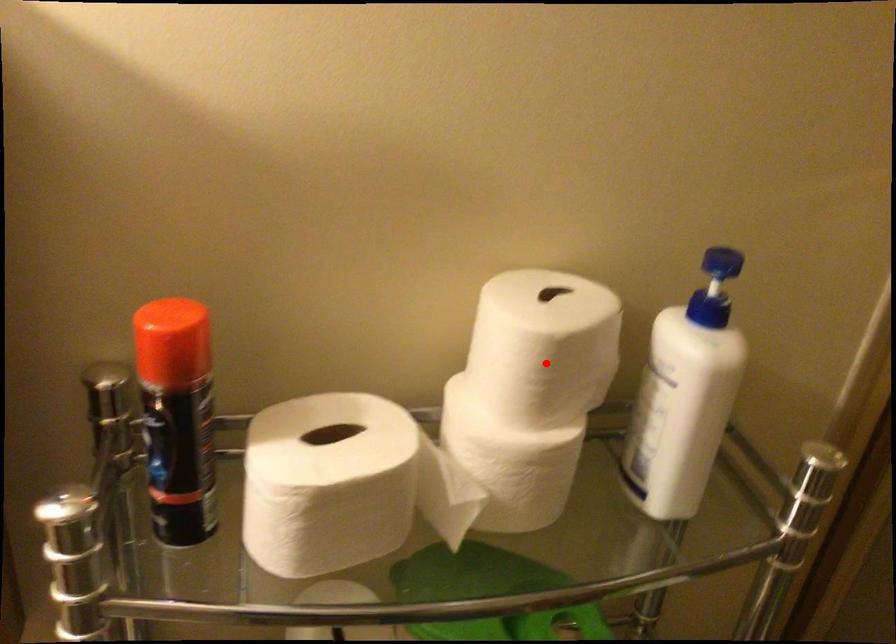
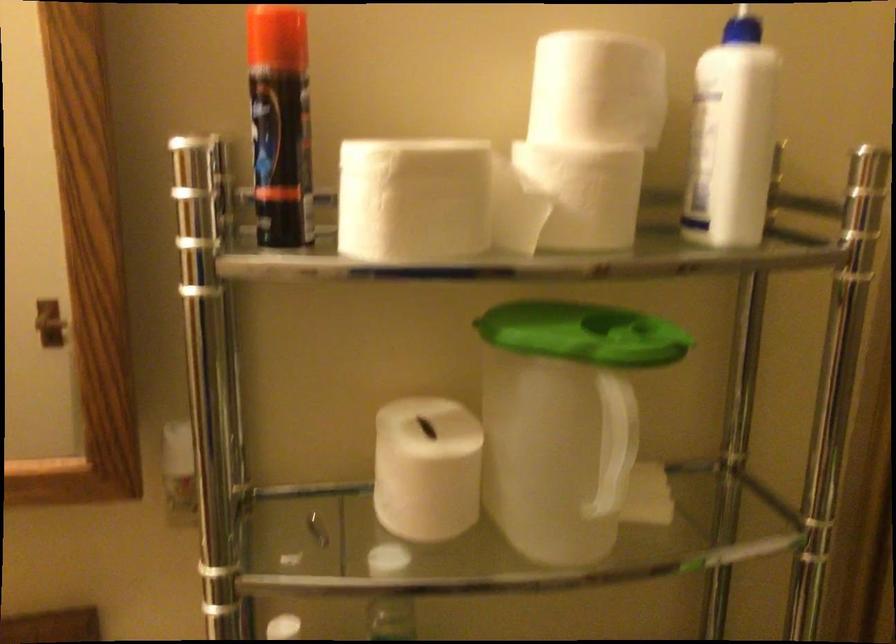
The point at the highlighted location is marked in the first image. Where is the corresponding point in the second image?

(597, 89)